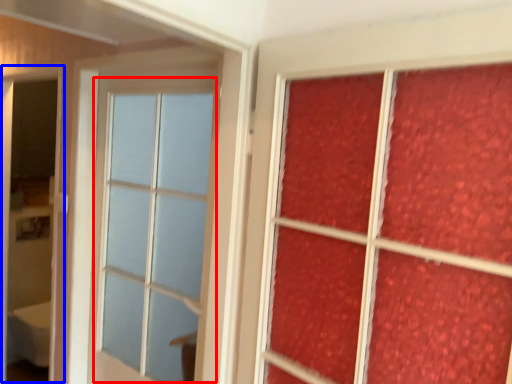
Question: Which object appears closest to the camera in this image, glass window (highlighted by a red box) or screen door (highlighted by a blue box)?

Choices:
 (A) glass window
 (B) screen door

Answer: (A)